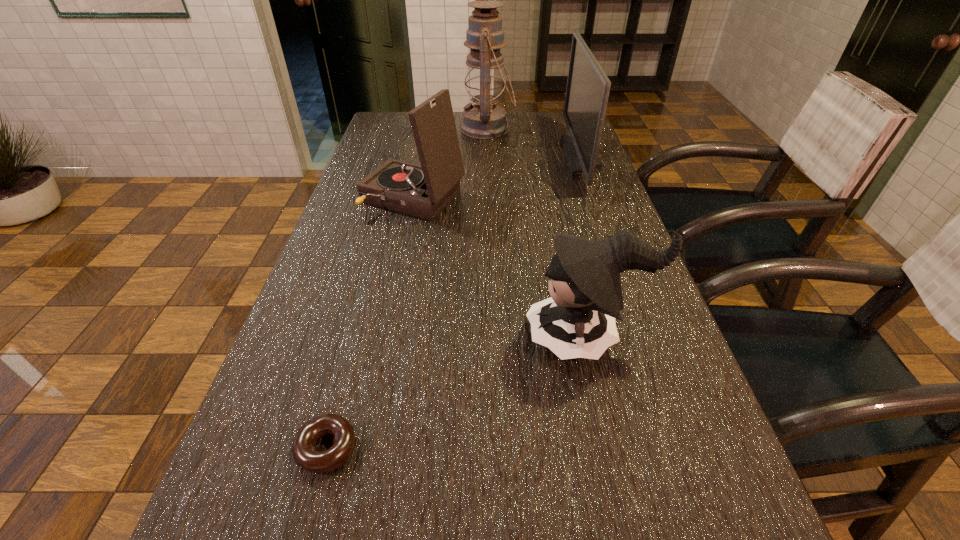
Where is `vacant area that lies between the oil lamp and the doll`? The height and width of the screenshot is (540, 960). vacant area that lies between the oil lamp and the doll is located at coordinates (538, 233).

Find the location of a particular element. The width and height of the screenshot is (960, 540). vacant area that lies between the tallest object and the fourth farthest object is located at coordinates (538, 233).

Where is `vacant region between the doughnut and the doll`? The image size is (960, 540). vacant region between the doughnut and the doll is located at coordinates (457, 393).

Locate an element on the screen. The image size is (960, 540). object that can be found as the fourth closest to the fourth farthest object is located at coordinates (485, 79).

The height and width of the screenshot is (540, 960). Identify the location of the third closest object to the monitor. (578, 321).

At what (x,y) coordinates should I click in order to perform the action: click on vacant area that satisfies the following two spatial constraints: 1. on the screen side of the monitor; 2. on the front side of the phonograph record. Please return your answer as a coordinate pair (x, y). Image resolution: width=960 pixels, height=540 pixels. Looking at the image, I should click on (596, 197).

I want to click on vacant position in the image that satisfies the following two spatial constraints: 1. on the screen side of the monitor; 2. on the front side of the shortest object, so click(x=687, y=448).